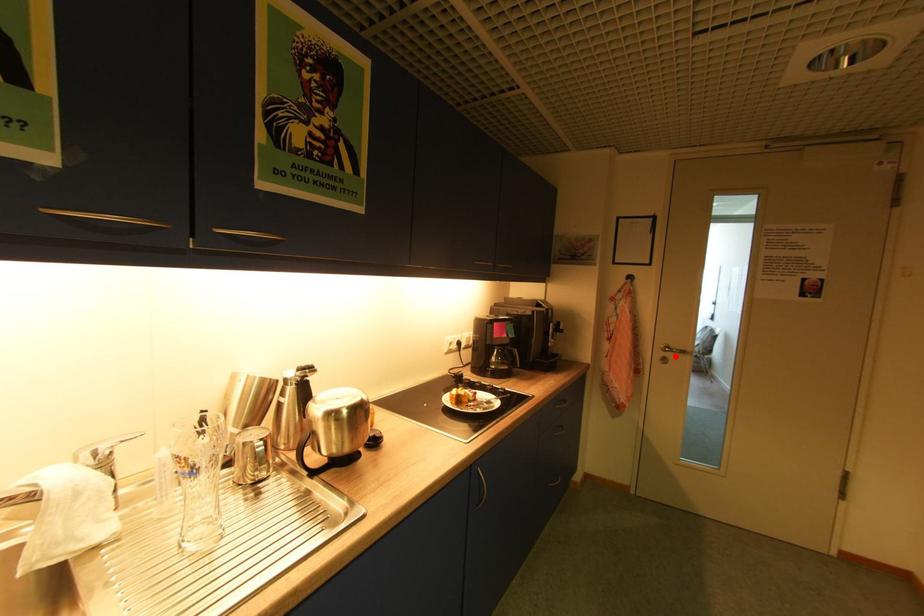
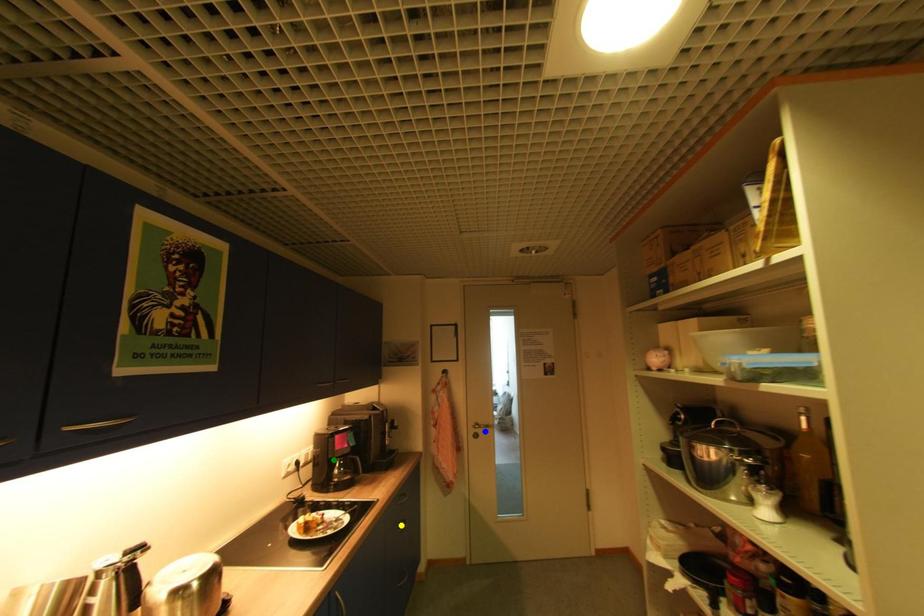
Question: I am providing you with two images of the same scene from different viewpoints. A red point is marked on the first image. You are given multiple points on the second image. Can you choose the point in image 2 that corresponds to the point in image 1?

Choices:
 (A) yellow point
 (B) blue point
 (C) green point

Answer: (B)